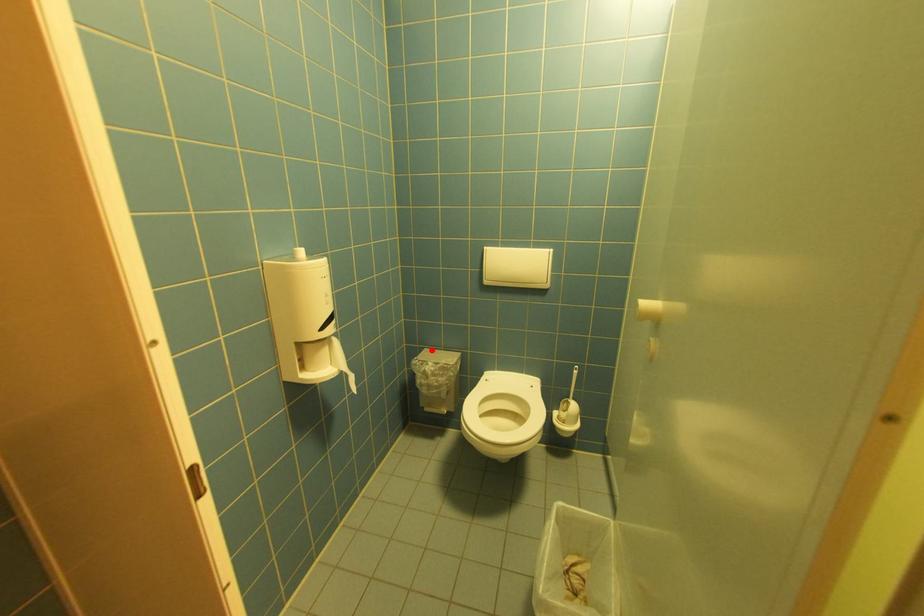
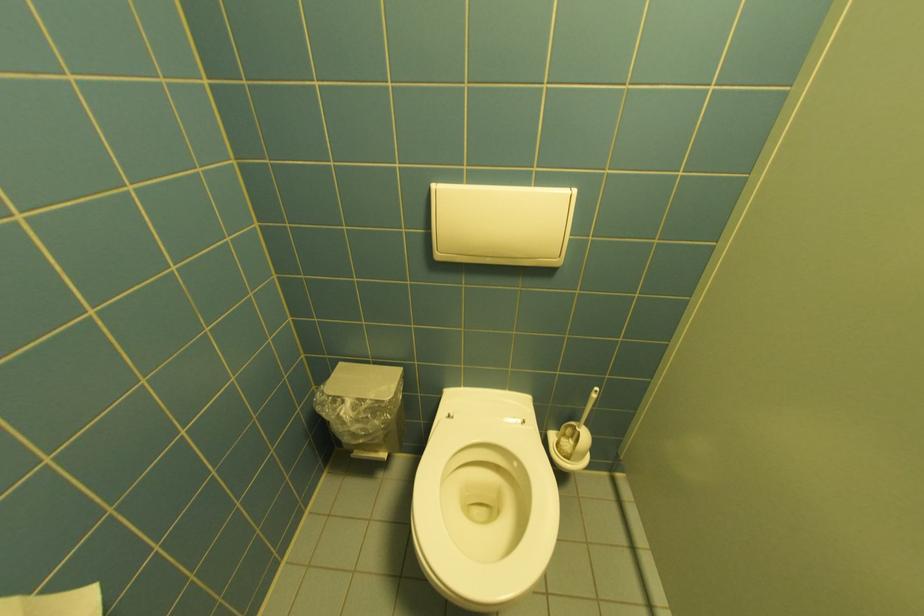
Locate, in the second image, the point that corresponds to the highlighted location in the first image.

(347, 365)